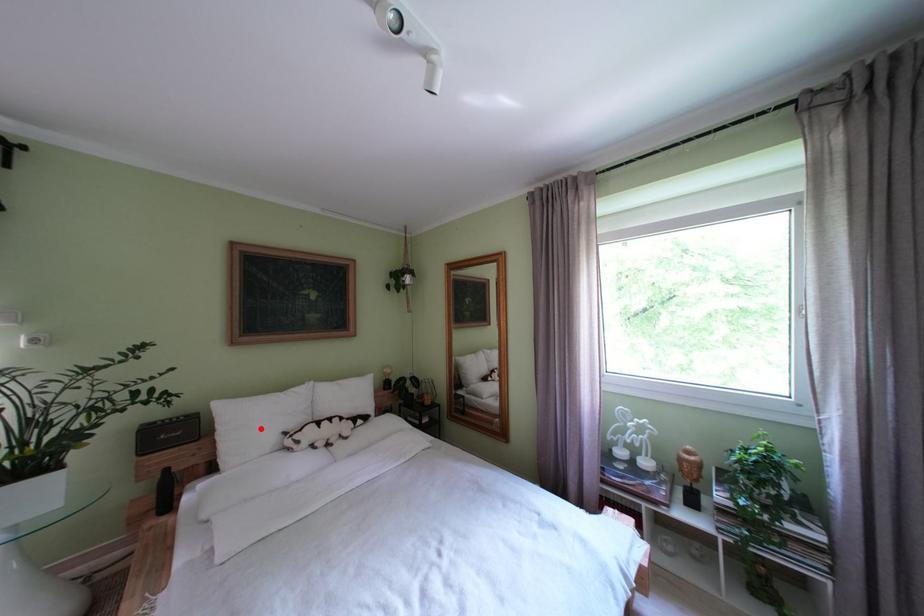
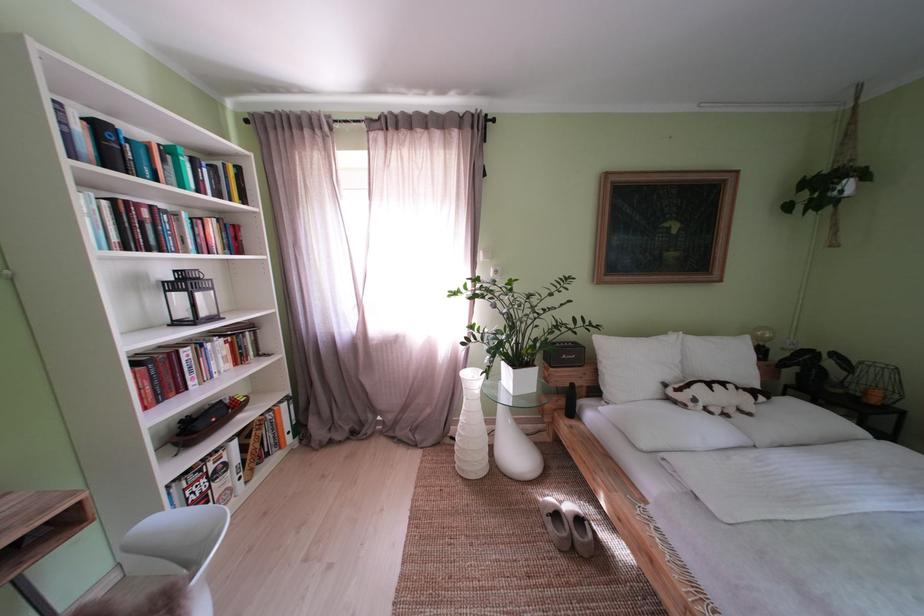
Question: I am providing you with two images of the same scene from different viewpoints. A red point is shown in image1. For the corresponding object point in image2, is it positioned nearer or farther from the camera?

Choices:
 (A) Nearer
 (B) Farther

Answer: (B)